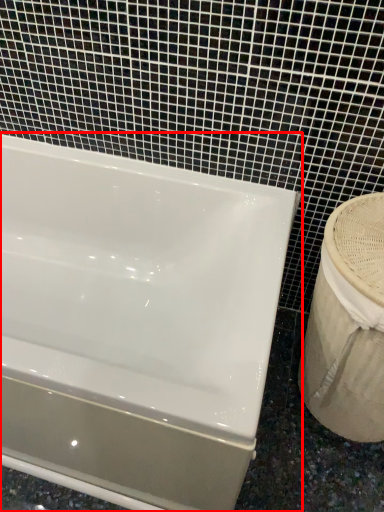
Question: Considering the relative positions of bathtub (annotated by the red box) and sink in the image provided, where is bathtub (annotated by the red box) located with respect to the staircase?

Choices:
 (A) left
 (B) right

Answer: (A)